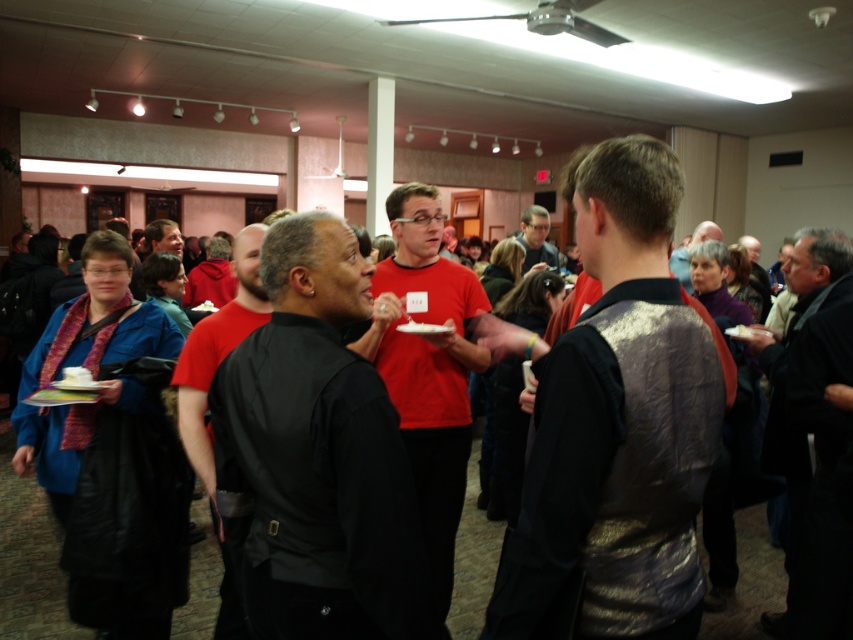
Between matte red shirt at center and black leather jacket at right, which one appears on the left side from the viewer's perspective?

Positioned to the left is matte red shirt at center.

Measure the distance between point (436, 364) and camera.

Point (436, 364) is 2.37 meters away from camera.

I want to click on matte red shirt at center, so click(428, 368).

Is matte black shirt at center in front of matte black vest at center?

No.

Does point (529, 248) come closer to viewer compared to point (682, 282)?

No, (529, 248) is further to viewer.

Who is more distant from viewer, (537, 259) or (706, 228)?

The point (537, 259) is behind.

Find the location of `matte black shirt at center`. matte black shirt at center is located at coordinates (537, 237).

Which is above, matte red shirt at center or matte black shirt at center?

Positioned higher is matte black shirt at center.

Is matte red shirt at center below matte black shirt at center?

Indeed, matte red shirt at center is positioned under matte black shirt at center.

Between point (387, 364) and point (532, 227), which one is positioned behind?

The point (532, 227) is behind.

Identify the location of matte red shirt at center. The width and height of the screenshot is (853, 640). (428, 368).